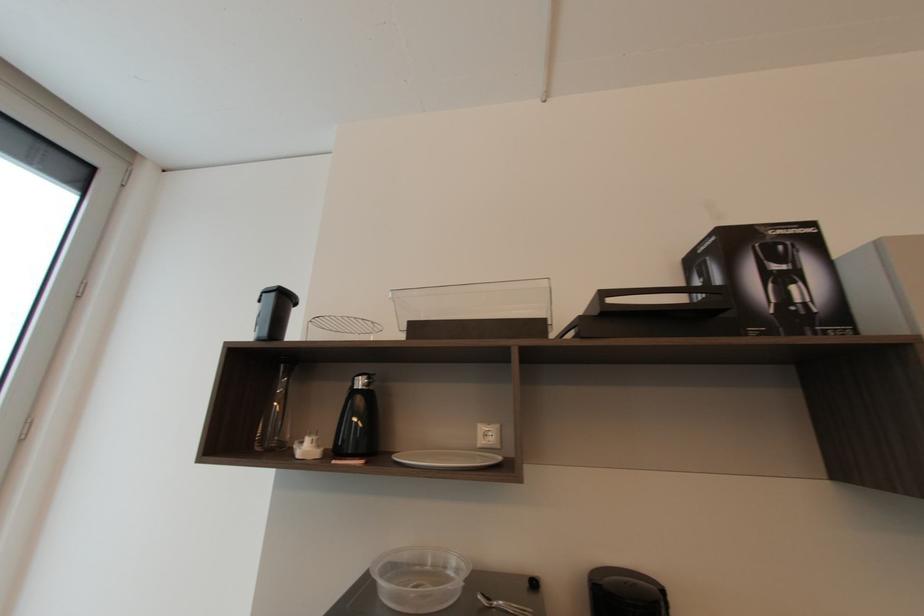
Find the location of a particular element. This screenshot has height=616, width=924. white power adapter is located at coordinates (308, 447).